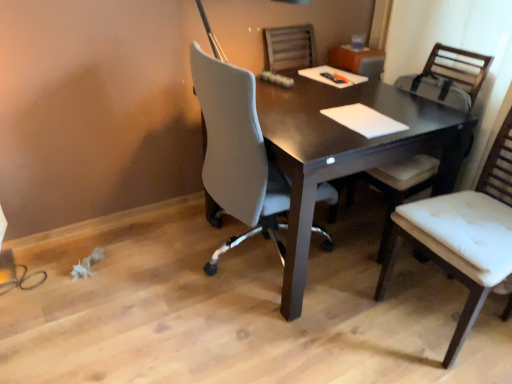
At what (x,y) coordinates should I click in order to perform the action: click on vacant space that is to the left of dark wood desk at center. Please return your answer as a coordinate pair (x, y). Looking at the image, I should click on (135, 279).